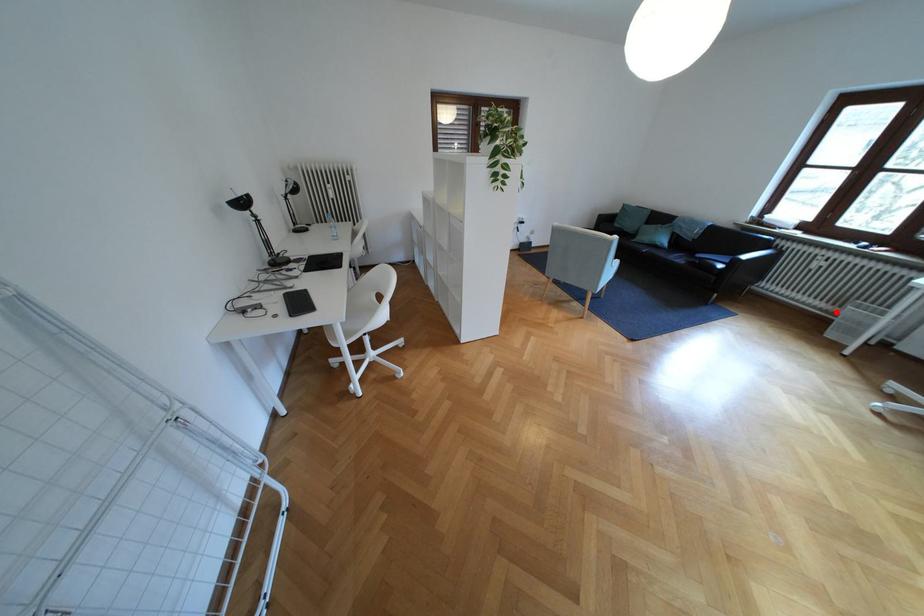
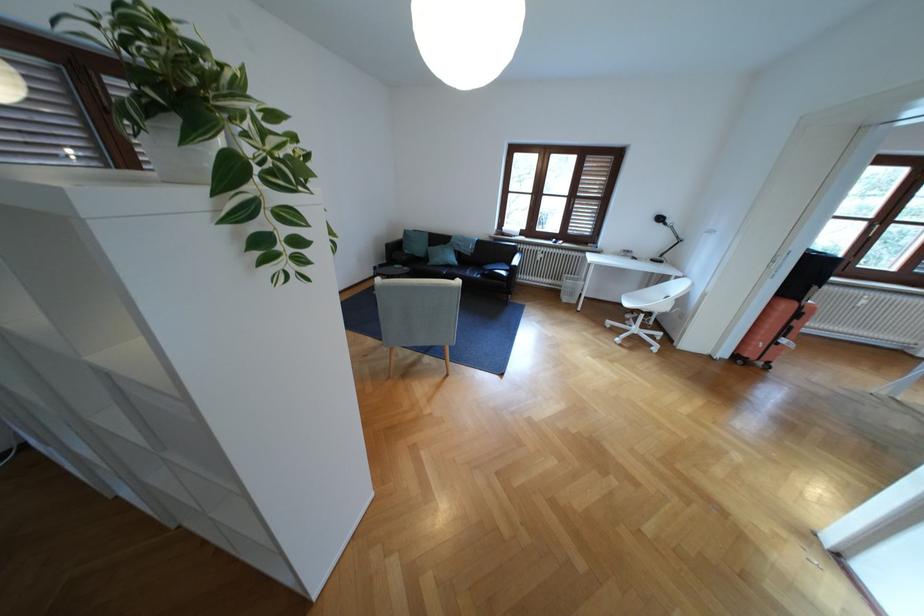
Locate, in the second image, the point that corresponds to the highlighted location in the first image.

(563, 285)